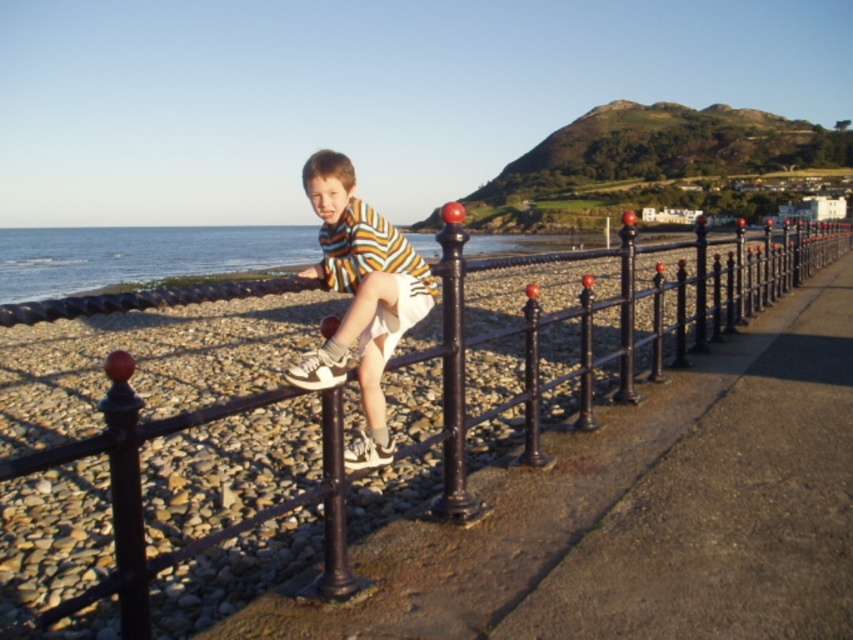
Who is positioned more to the left, black wrought iron fence at center or glossy black pole at center?

glossy black pole at center

Is point (296, 394) less distant than point (456, 230)?

Yes, it is in front of point (456, 230).

What are the coordinates of `black wrought iron fence at center` in the screenshot? It's located at (653, 310).

The width and height of the screenshot is (853, 640). Identify the location of black wrought iron fence at center. (653, 310).

Who is positioned more to the left, black wrought iron fence at center or striped cotton shirt at center?

Positioned to the left is striped cotton shirt at center.

I want to click on black wrought iron fence at center, so click(653, 310).

Describe the element at coordinates (360, 298) in the screenshot. The height and width of the screenshot is (640, 853). I see `striped cotton shirt at center` at that location.

Can you confirm if striped cotton shirt at center is positioned to the left of glossy black pole at center?

Yes, striped cotton shirt at center is to the left of glossy black pole at center.

Which is behind, point (316, 374) or point (445, 433)?

Point (445, 433)

Locate an element on the screen. striped cotton shirt at center is located at coordinates (360, 298).